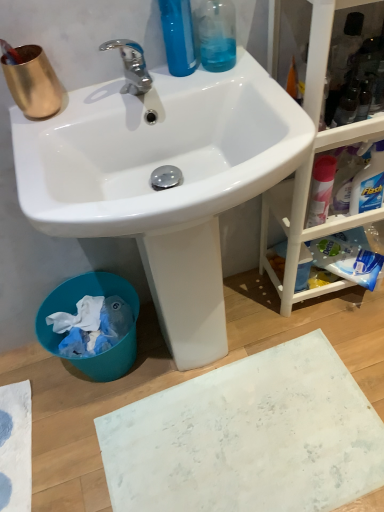
The image size is (384, 512). I want to click on vacant region to the left of transparent plastic bottle at upper center, so click(x=153, y=87).